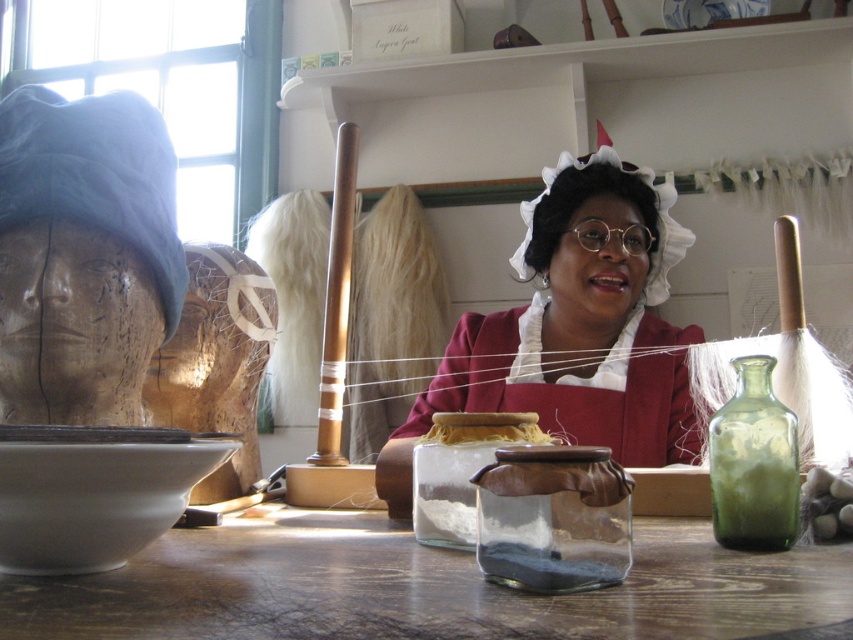
Does transparent glass jar at center have a smaller size compared to matte red dress at center?

Correct, transparent glass jar at center occupies less space than matte red dress at center.

Is transparent glass jar at center below matte red dress at center?

Yes.

Identify the location of transparent glass jar at center. (422, 588).

Which is behind, point (798, 500) or point (444, 433)?

Point (444, 433)

Is green glass bottle at right shorter than yellow string at center?

No.

Is point (796, 534) closer to camera compared to point (486, 417)?

Yes, point (796, 534) is in front of point (486, 417).

Image resolution: width=853 pixels, height=640 pixels. I want to click on green glass bottle at right, so click(x=753, y=461).

Does transparent glass jar at center appear on the right side of green glass bottle at right?

Incorrect, transparent glass jar at center is not on the right side of green glass bottle at right.

Is transparent glass jar at center taller than green glass bottle at right?

Incorrect, transparent glass jar at center's height is not larger of green glass bottle at right's.

Identify the location of transparent glass jar at center. This screenshot has width=853, height=640. (422, 588).